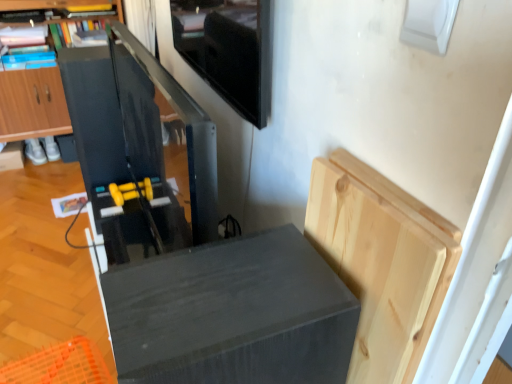
The height and width of the screenshot is (384, 512). In order to click on free space above matte black speaker at lower center (from a real-world perspective) in this screenshot , I will do `click(223, 292)`.